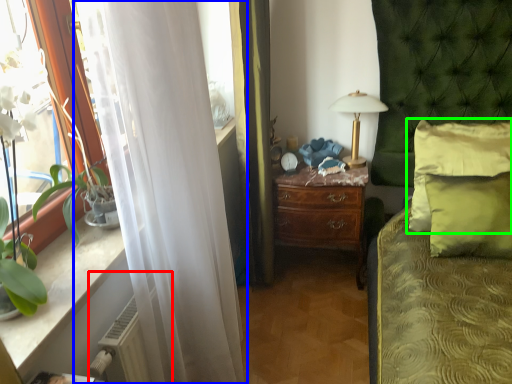
Question: Considering the real-world distances, which object is closest to radiator (highlighted by a red box)? curtain (highlighted by a blue box) or pillow (highlighted by a green box).

Choices:
 (A) curtain
 (B) pillow

Answer: (A)